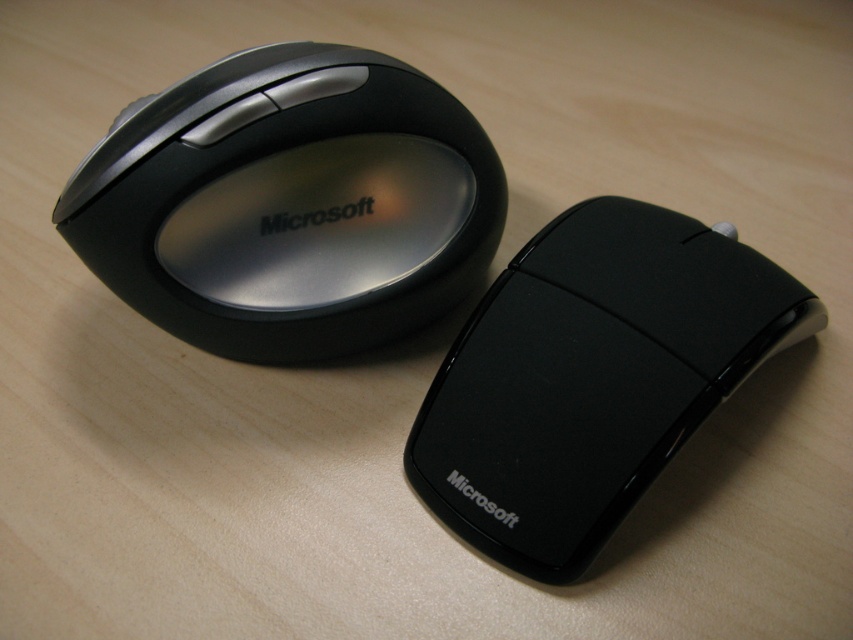
You are organizing a tech showcase and need to place a decorative item between the satin black mouse at upper left and the black glossy mouse at center. Based on their positions, which mouse should the decorative item be closer to?

The decorative item should be closer to the black glossy mouse at center because the satin black mouse at upper left is closer to the viewer, meaning there is more space between the two mice farther away from the viewer.

You have a small desk with limited space and need to place both the satin black mouse at upper left and the black glossy mouse at center. Which mouse should you choose to fit better in the limited space?

The black glossy mouse at center is smaller, so it will fit better in the limited space.